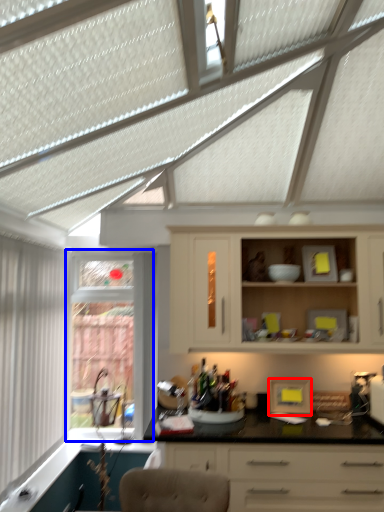
Question: Which point is closer to the camera, appliance (highlighted by a red box) or window (highlighted by a blue box)?

Choices:
 (A) appliance
 (B) window

Answer: (A)